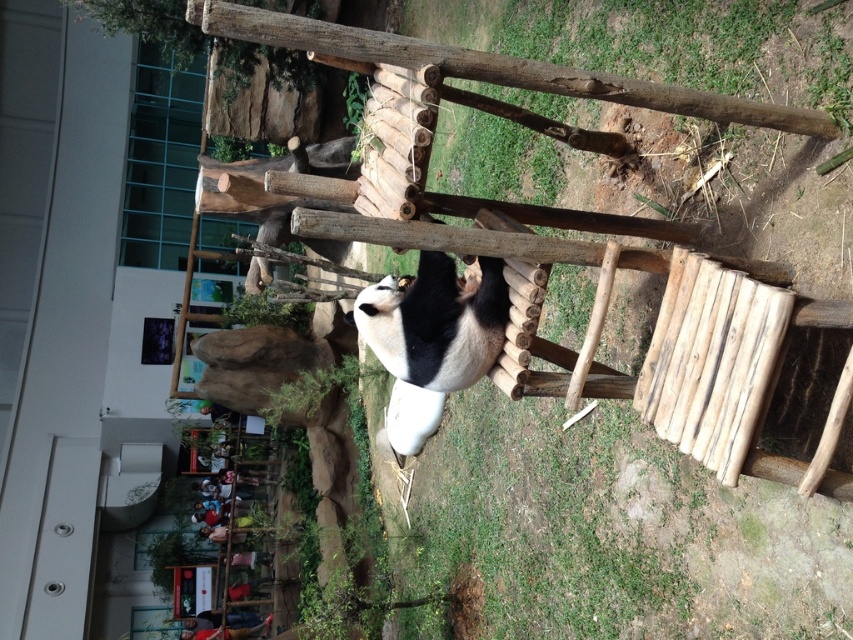
Question: Is black and white fur at center to the left of wooden ladder at lower left from the viewer's perspective?

Choices:
 (A) no
 (B) yes

Answer: (A)

Question: Does black and white fur at center have a lesser width compared to wooden ladder at lower left?

Choices:
 (A) yes
 (B) no

Answer: (A)

Question: Which of the following is the farthest from the observer?

Choices:
 (A) black and white fur at center
 (B) wooden ladder at lower left

Answer: (B)

Question: Is black and white fur at center above wooden ladder at lower left?

Choices:
 (A) yes
 (B) no

Answer: (A)

Question: Which object appears closest to the camera in this image?

Choices:
 (A) wooden ladder at lower left
 (B) black and white fur at center

Answer: (B)